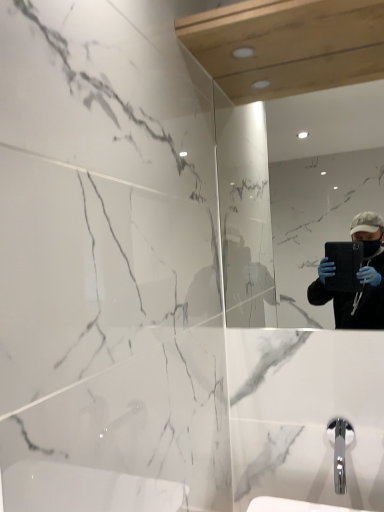
Question: Should I look upward or downward to see chrome metallic faucet at lower right?

Choices:
 (A) up
 (B) down

Answer: (B)

Question: Is chrome metallic faucet at lower right surrounding matte black tablet at right?

Choices:
 (A) no
 (B) yes

Answer: (A)

Question: Can you confirm if chrome metallic faucet at lower right is shorter than matte black tablet at right?

Choices:
 (A) no
 (B) yes

Answer: (B)

Question: Considering the relative sizes of chrome metallic faucet at lower right and matte black tablet at right in the image provided, is chrome metallic faucet at lower right smaller than matte black tablet at right?

Choices:
 (A) no
 (B) yes

Answer: (B)

Question: Does chrome metallic faucet at lower right lie in front of matte black tablet at right?

Choices:
 (A) no
 (B) yes

Answer: (B)

Question: From a real-world perspective, is chrome metallic faucet at lower right over matte black tablet at right?

Choices:
 (A) yes
 (B) no

Answer: (B)

Question: Considering the relative sizes of chrome metallic faucet at lower right and matte black tablet at right in the image provided, is chrome metallic faucet at lower right bigger than matte black tablet at right?

Choices:
 (A) yes
 (B) no

Answer: (B)

Question: Does matte black tablet at right have a larger size compared to chrome metallic faucet at lower right?

Choices:
 (A) no
 (B) yes

Answer: (B)

Question: Can you confirm if matte black tablet at right is shorter than chrome metallic faucet at lower right?

Choices:
 (A) no
 (B) yes

Answer: (A)

Question: From a real-world perspective, is matte black tablet at right positioned under chrome metallic faucet at lower right based on gravity?

Choices:
 (A) yes
 (B) no

Answer: (B)

Question: Considering the relative sizes of matte black tablet at right and chrome metallic faucet at lower right in the image provided, is matte black tablet at right smaller than chrome metallic faucet at lower right?

Choices:
 (A) no
 (B) yes

Answer: (A)

Question: Does matte black tablet at right have a greater width compared to chrome metallic faucet at lower right?

Choices:
 (A) yes
 (B) no

Answer: (B)

Question: Is matte black tablet at right not within chrome metallic faucet at lower right?

Choices:
 (A) no
 (B) yes

Answer: (B)

Question: In terms of size, does chrome metallic faucet at lower right appear bigger or smaller than matte black tablet at right?

Choices:
 (A) small
 (B) big

Answer: (A)